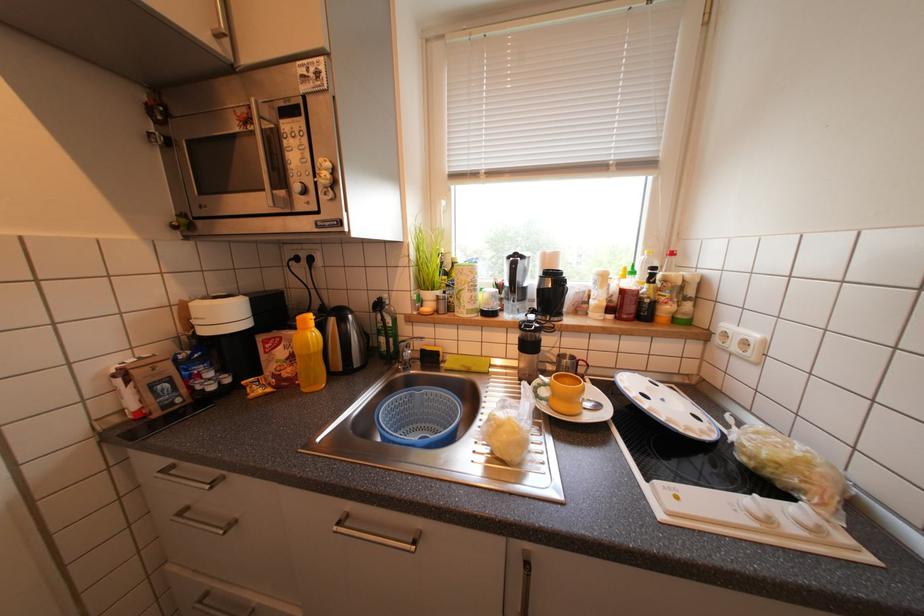
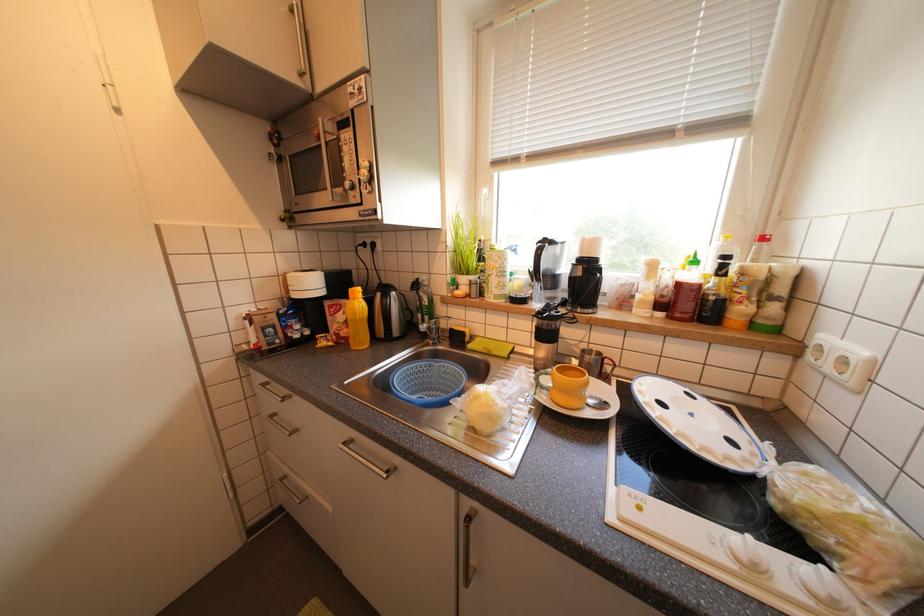
Question: What movement of the cameraman would produce the second image?

Choices:
 (A) Left
 (B) Right
 (C) Forward
 (D) Backward

Answer: (B)